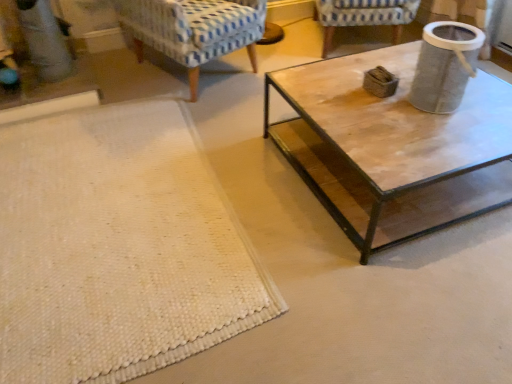
Question: Based on their sizes in the image, would you say blue-patterned fabric chair at upper center, which is the first chair from right to left, is bigger or smaller than textured gray trash can at upper right?

Choices:
 (A) big
 (B) small

Answer: (A)

Question: In the image, is blue-patterned fabric chair at upper center, the 2th chair from the left, on the left side or the right side of textured gray trash can at upper right?

Choices:
 (A) right
 (B) left

Answer: (B)

Question: Considering the real-world distances, which object is closest to the textured gray trash can at upper right?

Choices:
 (A) blue-patterned fabric chair at upper center, the 2th chair from the left
 (B) blue patterned fabric chair at upper left, which appears as the first chair when viewed from the left
 (C) white woven mat at lower left

Answer: (C)

Question: Which of these objects is positioned farthest from the blue-patterned fabric chair at upper center, the 2th chair from the left?

Choices:
 (A) textured gray trash can at upper right
 (B) white woven mat at lower left
 (C) blue patterned fabric chair at upper left, which appears as the first chair when viewed from the left

Answer: (B)